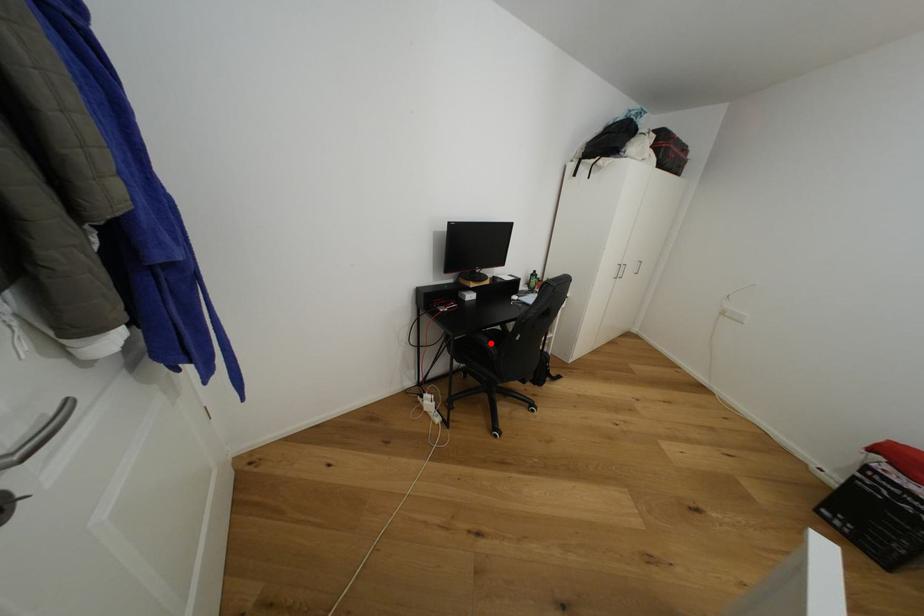
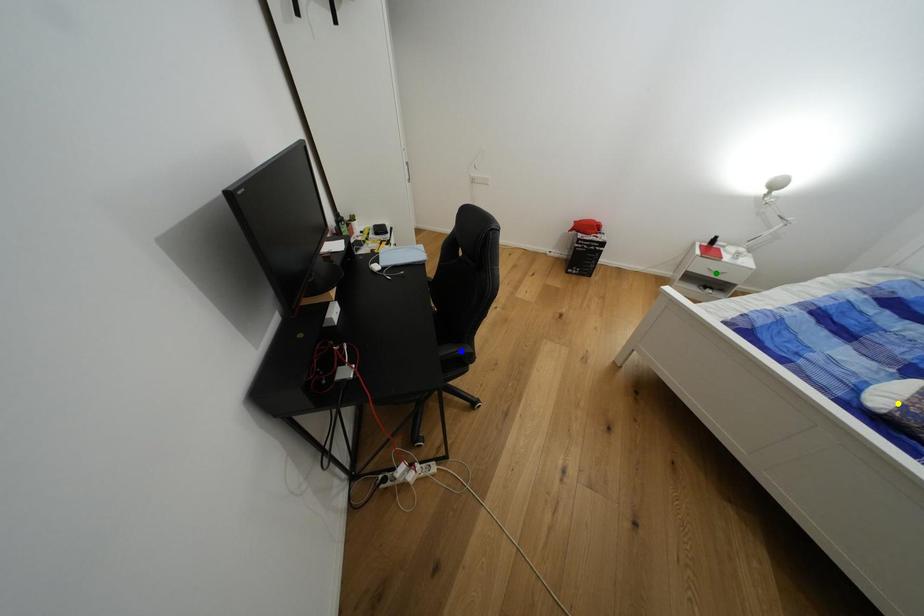
Question: I am providing you with two images of the same scene from different viewpoints. A red point is marked on the first image. You are given multiple points on the second image. In image 2, which mark is for the same physical point as the one in image 1?

Choices:
 (A) green point
 (B) yellow point
 (C) blue point

Answer: (C)